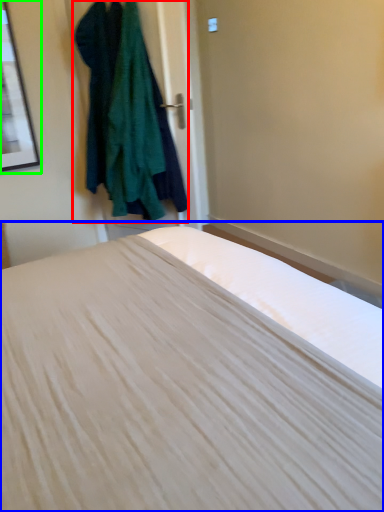
Question: Which object is positioned farthest from clothing (highlighted by a red box)? Select from bed (highlighted by a blue box) and picture frame (highlighted by a green box).

Choices:
 (A) bed
 (B) picture frame

Answer: (A)